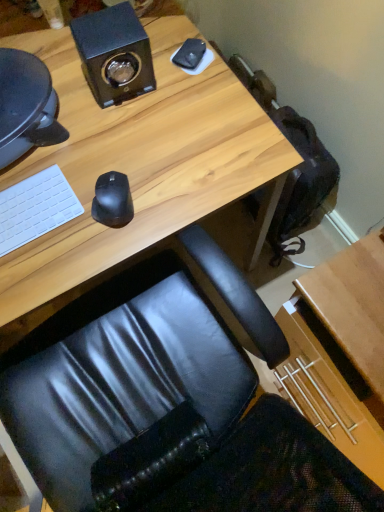
I want to click on vacant space situated on the left part of black matte mouse at center, so click(55, 223).